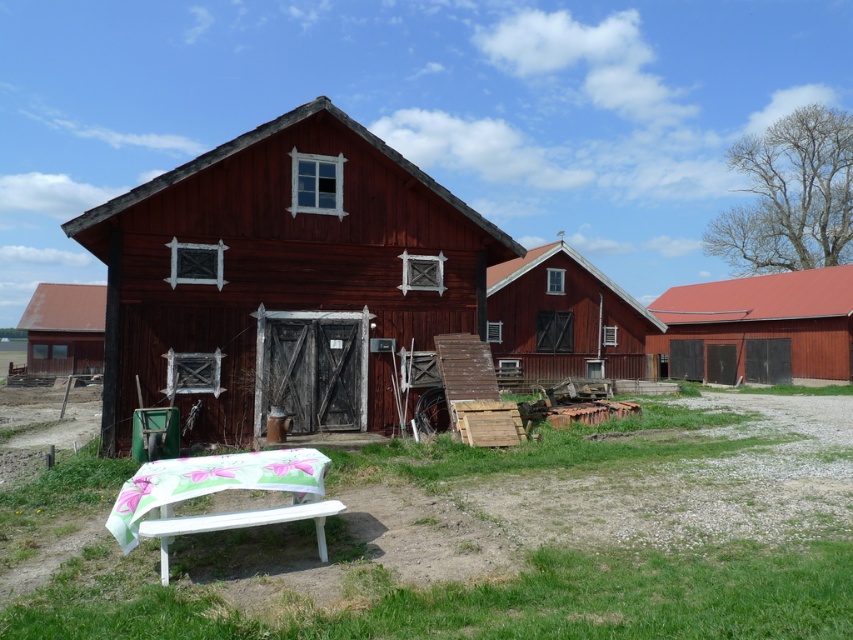
Question: Does smooth wooden barn at center come in front of smooth wooden barn door at right?

Choices:
 (A) yes
 (B) no

Answer: (A)

Question: Does smooth wooden hut at center appear under smooth red barn at left?

Choices:
 (A) no
 (B) yes

Answer: (B)

Question: Based on their relative distances, which object is farther from the smooth red barn at left?

Choices:
 (A) smooth wooden barn at center
 (B) smooth wooden barn door at right
 (C) smooth wooden hut at center

Answer: (B)

Question: Which object appears closest to the camera in this image?

Choices:
 (A) smooth red barn at left
 (B) smooth wooden barn door at right

Answer: (B)

Question: Where is smooth wooden barn at center located in relation to smooth wooden barn door at right in the image?

Choices:
 (A) right
 (B) left

Answer: (B)

Question: Among these objects, which one is nearest to the camera?

Choices:
 (A) smooth red barn at left
 (B) smooth wooden hut at center
 (C) smooth wooden barn door at right
 (D) white painted wood park bench at lower left

Answer: (D)